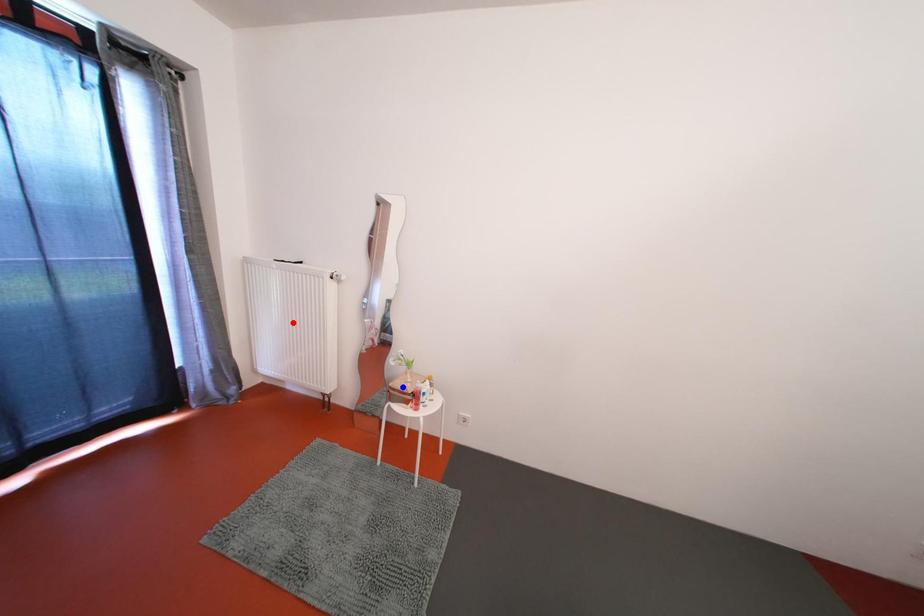
Question: Which of the two points in the image is closer to the camera?

Choices:
 (A) Blue point is closer.
 (B) Red point is closer.

Answer: (A)